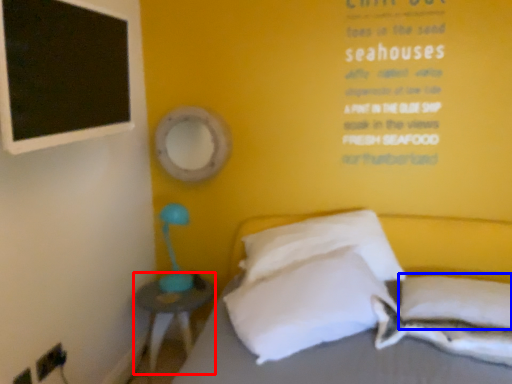
Question: Which point is further to the camera, nightstand (highlighted by a red box) or pillow (highlighted by a blue box)?

Choices:
 (A) nightstand
 (B) pillow

Answer: (A)